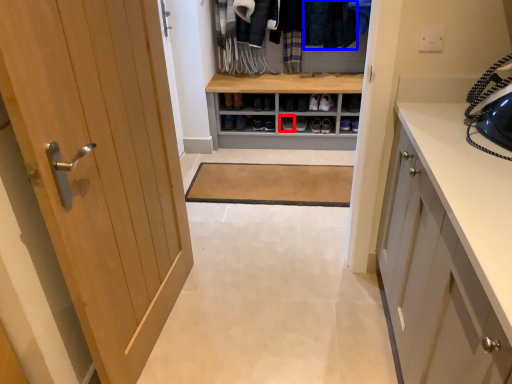
Question: Which object appears farthest to the camera in this image, footwear (highlighted by a red box) or clothing (highlighted by a blue box)?

Choices:
 (A) footwear
 (B) clothing

Answer: (A)